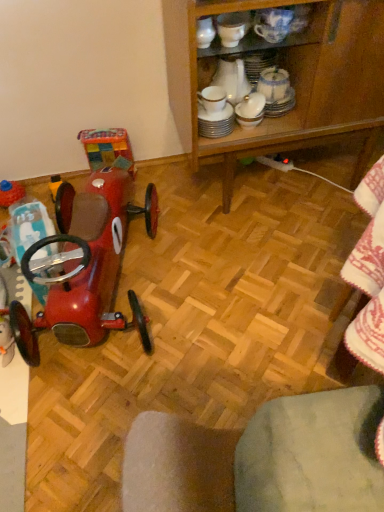
This screenshot has height=512, width=384. I want to click on free space on the front side of shiny red car at left, acting as the second toy starting from the left, so click(x=104, y=407).